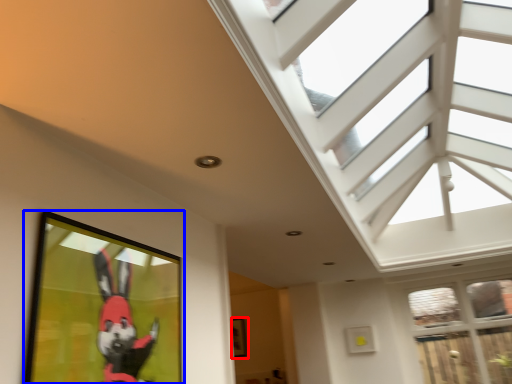
Question: Which point is further to the camera, picture frame (highlighted by a red box) or picture frame (highlighted by a blue box)?

Choices:
 (A) picture frame
 (B) picture frame

Answer: (A)